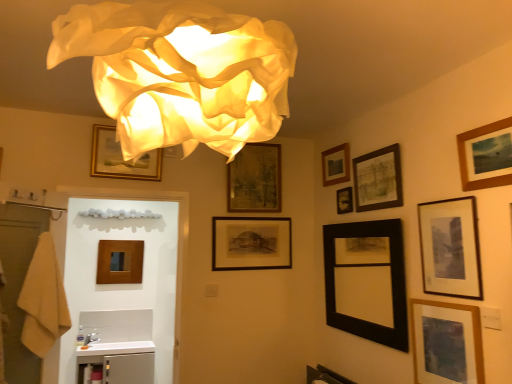
The image size is (512, 384). What do you see at coordinates (446, 343) in the screenshot? I see `wooden picture frame at lower right, the third picture frame positioned from the right` at bounding box center [446, 343].

Measure the distance between point (x=346, y=188) and camera.

The distance of point (x=346, y=188) from camera is 2.93 meters.

In order to face white glossy counter top at lower left, should I rotate leftwards or rightwards?

Rotate your view left by about 18.107°.

Image resolution: width=512 pixels, height=384 pixels. Describe the element at coordinates (121, 158) in the screenshot. I see `gold-framed picture at upper center, which ranks as the second picture frame in left-to-right order` at that location.

What do you see at coordinates (181, 72) in the screenshot?
I see `white fabric lamp at upper center` at bounding box center [181, 72].

The image size is (512, 384). I want to click on white fabric lamp at upper center, so click(181, 72).

What do you see at coordinates (251, 243) in the screenshot? Image resolution: width=512 pixels, height=384 pixels. I see `black matte picture frame at center, which is counted as the 9th picture frame, starting from the right` at bounding box center [251, 243].

Locate an element on the screen. wooden picture frame at lower right, the third picture frame positioned from the right is located at coordinates (446, 343).

Is point (270, 242) positioned after point (433, 333)?

Yes.

Find the location of a particular element. Image resolution: width=512 pixels, height=384 pixels. the 4th picture frame located above the wooden picture frame at lower right, which appears as the 9th picture frame when viewed from the left (from a real-world perspective) is located at coordinates (251, 243).

Which is more to the left, black matte picture frame at center, which is counted as the 9th picture frame, starting from the right, or wooden picture frame at lower right, which appears as the 9th picture frame when viewed from the left?

black matte picture frame at center, which is counted as the 9th picture frame, starting from the right.

Is black matte picture frame at center, the 3th picture frame when ordered from left to right, oriented towards wooden picture frame at lower right, which appears as the 9th picture frame when viewed from the left?

Yes, black matte picture frame at center, the 3th picture frame when ordered from left to right, is oriented towards wooden picture frame at lower right, which appears as the 9th picture frame when viewed from the left.

From a real-world perspective, is wooden picture frame at center, marked as the 11th picture frame in a right-to-left arrangement, physically located above or below black matte picture frame at center, the 3th picture frame when ordered from left to right?

In terms of real-world spatial position, wooden picture frame at center, marked as the 11th picture frame in a right-to-left arrangement, is below black matte picture frame at center, the 3th picture frame when ordered from left to right.

Where is `the 2nd picture frame positioned below the black matte picture frame at center, the 3th picture frame when ordered from left to right (from a real-world perspective)`? the 2nd picture frame positioned below the black matte picture frame at center, the 3th picture frame when ordered from left to right (from a real-world perspective) is located at coordinates (120, 261).

Which point is more forward, (109, 264) or (241, 248)?

The point (241, 248) is in front.

In the scene shown: From the image's perspective, between wooden picture frame at center, the first picture frame from the left, and black matte picture frame at center, the 3th picture frame when ordered from left to right, which one is located above?

black matte picture frame at center, the 3th picture frame when ordered from left to right, appears higher in the image.

Looking at this image, which of these two, matte black picture frame at upper right, positioned as the fourth picture frame in right-to-left order, or gold-framed picture at upper center, which ranks as the second picture frame in left-to-right order, stands taller?

With more height is matte black picture frame at upper right, positioned as the fourth picture frame in right-to-left order.

Is matte black picture frame at upper right, positioned as the fourth picture frame in right-to-left order, next to gold-framed picture at upper center, which ranks as the second picture frame in left-to-right order?

There is a gap between matte black picture frame at upper right, positioned as the fourth picture frame in right-to-left order, and gold-framed picture at upper center, which ranks as the second picture frame in left-to-right order.

Is matte black picture frame at upper right, positioned as the 8th picture frame in left-to-right order, not within gold-framed picture at upper center, which ranks as the second picture frame in left-to-right order?

That's correct, matte black picture frame at upper right, positioned as the 8th picture frame in left-to-right order, is outside of gold-framed picture at upper center, which ranks as the second picture frame in left-to-right order.

Based on their positions, is matte black picture frame at upper right, positioned as the fourth picture frame in right-to-left order, located to the left or right of gold-framed picture at upper center, which ranks as the second picture frame in left-to-right order?

matte black picture frame at upper right, positioned as the fourth picture frame in right-to-left order, is to the right of gold-framed picture at upper center, which ranks as the second picture frame in left-to-right order.

Consider the image. Does wooden framed picture at upper right, marked as the 1th picture frame in a right-to-left arrangement, turn towards black matte picture frame at upper center, which ranks as the sixth picture frame in left-to-right order?

No, wooden framed picture at upper right, marked as the 1th picture frame in a right-to-left arrangement, does not turn towards black matte picture frame at upper center, which ranks as the sixth picture frame in left-to-right order.

From the black matte picture frame at upper center, which ranks as the sixth picture frame in left-to-right order, count 5th picture frame to the right and point to it. Please provide its 2D coordinates.

[(486, 156)]

From the image's perspective, is wooden framed picture at upper right, which appears as the eleventh picture frame when viewed from the left, below black matte picture frame at upper center, placed as the 6th picture frame when sorted from right to left?

No.

From the picture: Considering the relative sizes of wooden framed picture at upper right, which appears as the eleventh picture frame when viewed from the left, and black matte picture frame at upper center, placed as the 6th picture frame when sorted from right to left, in the image provided, is wooden framed picture at upper right, which appears as the eleventh picture frame when viewed from the left, thinner than black matte picture frame at upper center, placed as the 6th picture frame when sorted from right to left,?

No.

Who is shorter, wooden framed picture at upper center, the fourth picture frame positioned from the left, or matte black picture frame at upper right, positioned as the 8th picture frame in left-to-right order?

Standing shorter between the two is matte black picture frame at upper right, positioned as the 8th picture frame in left-to-right order.

Relative to matte black picture frame at upper right, positioned as the fourth picture frame in right-to-left order, is wooden framed picture at upper center, acting as the eighth picture frame starting from the right, in front or behind?

Clearly, wooden framed picture at upper center, acting as the eighth picture frame starting from the right, is behind matte black picture frame at upper right, positioned as the fourth picture frame in right-to-left order.

From a real-world perspective, is wooden framed picture at upper center, the fourth picture frame positioned from the left, positioned above or below matte black picture frame at upper right, positioned as the 8th picture frame in left-to-right order?

wooden framed picture at upper center, the fourth picture frame positioned from the left, is above matte black picture frame at upper right, positioned as the 8th picture frame in left-to-right order.

Looking at the image, does wooden framed picture at upper center, acting as the eighth picture frame starting from the right, seem bigger or smaller compared to matte black picture frame at upper right, positioned as the 8th picture frame in left-to-right order?

Considering their sizes, wooden framed picture at upper center, acting as the eighth picture frame starting from the right, takes up more space than matte black picture frame at upper right, positioned as the 8th picture frame in left-to-right order.

Which of these two, black matte picture frame at center-right, the 5th picture frame viewed from the right, or white fabric lamp at upper center, is wider?

white fabric lamp at upper center.

Between point (386, 251) and point (258, 81), which one is positioned behind?

Positioned behind is point (386, 251).

Is black matte picture frame at center-right, which ranks as the seventh picture frame in left-to-right order, looking in the opposite direction of white fabric lamp at upper center?

black matte picture frame at center-right, which ranks as the seventh picture frame in left-to-right order, does not have its back to white fabric lamp at upper center.

Is black matte picture frame at center-right, the 5th picture frame viewed from the right, further to the viewer compared to white fabric lamp at upper center?

Yes, black matte picture frame at center-right, the 5th picture frame viewed from the right, is behind white fabric lamp at upper center.

Between black matte picture frame at upper right, positioned as the tenth picture frame in left-to-right order, and gold-framed picture at upper center, which ranks as the second picture frame in left-to-right order, which one has more height?

black matte picture frame at upper right, positioned as the tenth picture frame in left-to-right order, is taller.

Does point (453, 264) come closer to viewer compared to point (122, 160)?

Yes, it is in front of point (122, 160).

Would you say gold-framed picture at upper center, which is the tenth picture frame from right to left, is part of black matte picture frame at upper right, positioned as the tenth picture frame in left-to-right order,'s contents?

Definitely not — gold-framed picture at upper center, which is the tenth picture frame from right to left, is not inside black matte picture frame at upper right, positioned as the tenth picture frame in left-to-right order.

From the wooden picture frame at lower right, which appears as the 9th picture frame when viewed from the left, count the 6th picture frame to the left and point to it. Please provide its 2D coordinates.

[(251, 243)]

Locate an element on the screen. This screenshot has height=384, width=512. the 2nd picture frame positioned above the wooden picture frame at center, marked as the 11th picture frame in a right-to-left arrangement (from a real-world perspective) is located at coordinates (251, 243).

Considering their positions, is wooden picture frame at upper center, the 5th picture frame positioned from the left, positioned closer to white glossy sink at lower left than gold-framed picture at upper center, which ranks as the second picture frame in left-to-right order?

gold-framed picture at upper center, which ranks as the second picture frame in left-to-right order, is closer to white glossy sink at lower left.

Looking at the image, which one is located further to white glossy counter top at lower left, black matte picture frame at center-right, the 5th picture frame viewed from the right, or black matte picture frame at upper center, which ranks as the sixth picture frame in left-to-right order?

black matte picture frame at upper center, which ranks as the sixth picture frame in left-to-right order, lies further to white glossy counter top at lower left than the other object.

Estimate the real-world distances between objects in this image. Which object is closer to wooden framed picture at upper right, marked as the 1th picture frame in a right-to-left arrangement, white glossy sink at lower left or black matte picture frame at upper right, placed as the second picture frame when sorted from right to left?

black matte picture frame at upper right, placed as the second picture frame when sorted from right to left, is closer to wooden framed picture at upper right, marked as the 1th picture frame in a right-to-left arrangement.

From the image, which object appears to be nearer to beige cotton bath towel at left, black matte picture frame at center-right, the 5th picture frame viewed from the right, or black matte picture frame at upper center, placed as the 6th picture frame when sorted from right to left?

black matte picture frame at center-right, the 5th picture frame viewed from the right, lies closer to beige cotton bath towel at left than the other object.

Looking at this image, considering their positions, is black matte picture frame at center, which is counted as the 9th picture frame, starting from the right, positioned closer to black matte picture frame at upper center, placed as the 6th picture frame when sorted from right to left, than gold-framed picture at upper center, which is the tenth picture frame from right to left?

black matte picture frame at center, which is counted as the 9th picture frame, starting from the right, is closer to black matte picture frame at upper center, placed as the 6th picture frame when sorted from right to left.

Considering their positions, is wooden picture frame at upper center, positioned as the seventh picture frame in right-to-left order, positioned further to gold-framed picture at upper center, which is the tenth picture frame from right to left, than black matte picture frame at upper center, placed as the 6th picture frame when sorted from right to left?

black matte picture frame at upper center, placed as the 6th picture frame when sorted from right to left, lies further to gold-framed picture at upper center, which is the tenth picture frame from right to left, than the other object.

From the image, which object appears to be farther from wooden framed picture at upper right, which appears as the eleventh picture frame when viewed from the left, gold-framed picture at upper center, which ranks as the second picture frame in left-to-right order, or black matte picture frame at upper right, placed as the second picture frame when sorted from right to left?

Among the two, gold-framed picture at upper center, which ranks as the second picture frame in left-to-right order, is located further to wooden framed picture at upper right, which appears as the eleventh picture frame when viewed from the left.

Which object lies nearer to the anchor point wooden picture frame at lower right, the third picture frame positioned from the right, black matte picture frame at center-right, which ranks as the seventh picture frame in left-to-right order, or beige cotton bath towel at left?

black matte picture frame at center-right, which ranks as the seventh picture frame in left-to-right order, is closer to wooden picture frame at lower right, the third picture frame positioned from the right.

The image size is (512, 384). I want to click on counter top between white fabric lamp at upper center and wooden picture frame at center, marked as the 11th picture frame in a right-to-left arrangement, along the z-axis, so click(x=117, y=348).

Locate an element on the screen. bath towel between gold-framed picture at upper center, which ranks as the second picture frame in left-to-right order, and white glossy sink at lower left in the up-down direction is located at coordinates (42, 299).

At what (x,y) coordinates should I click in order to perform the action: click on sink between beige cotton bath towel at left and black matte picture frame at upper center, which ranks as the sixth picture frame in left-to-right order, from left to right. Please return your answer as a coordinate pair (x, y). This screenshot has width=512, height=384. Looking at the image, I should click on (120, 345).

This screenshot has height=384, width=512. Find the location of `bath towel between white fabric lamp at upper center and black matte picture frame at upper center, which ranks as the sixth picture frame in left-to-right order, along the z-axis`. bath towel between white fabric lamp at upper center and black matte picture frame at upper center, which ranks as the sixth picture frame in left-to-right order, along the z-axis is located at coordinates (42, 299).